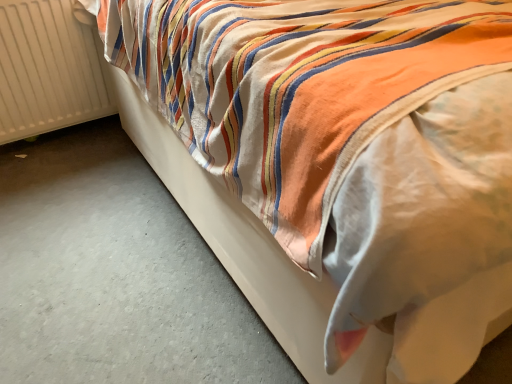
Image resolution: width=512 pixels, height=384 pixels. What do you see at coordinates (47, 70) in the screenshot? I see `white ribbed radiator at left` at bounding box center [47, 70].

Find the location of a particular element. white ribbed radiator at left is located at coordinates (47, 70).

Describe the element at coordinates (114, 274) in the screenshot. The width and height of the screenshot is (512, 384). I see `white smooth concrete at lower left` at that location.

Where is `white smooth concrete at lower left`? The width and height of the screenshot is (512, 384). white smooth concrete at lower left is located at coordinates (114, 274).

This screenshot has width=512, height=384. In order to click on white ribbed radiator at left in this screenshot , I will do `click(47, 70)`.

Does white smooth concrete at lower left appear on the left side of white ribbed radiator at left?

No, white smooth concrete at lower left is not to the left of white ribbed radiator at left.

Which object is closer to the camera, white smooth concrete at lower left or white ribbed radiator at left?

Positioned in front is white smooth concrete at lower left.

Which point is more forward, (7, 175) or (16, 127)?

The point (7, 175) is closer to the camera.

From the picture: From the image's perspective, is white smooth concrete at lower left above or below white ribbed radiator at left?

Clearly, from the image's perspective, white smooth concrete at lower left is below white ribbed radiator at left.

From a real-world perspective, between white smooth concrete at lower left and white ribbed radiator at left, who is vertically higher?

From a 3D spatial view, white ribbed radiator at left is above.

Looking at this image, can you confirm if white smooth concrete at lower left is thinner than white ribbed radiator at left?

No, white smooth concrete at lower left is not thinner than white ribbed radiator at left.

Can you confirm if white smooth concrete at lower left is taller than white ribbed radiator at left?

No.

Can you confirm if white smooth concrete at lower left is smaller than white ribbed radiator at left?

Actually, white smooth concrete at lower left might be larger than white ribbed radiator at left.

Is white smooth concrete at lower left located outside white ribbed radiator at left?

white smooth concrete at lower left lies outside white ribbed radiator at left's area.

Are white smooth concrete at lower left and white ribbed radiator at left making contact?

No.

Is white smooth concrete at lower left oriented towards white ribbed radiator at left?

No.

At what (x,y) coordinates should I click in order to perform the action: click on concrete below the white ribbed radiator at left (from the image's perspective). Please return your answer as a coordinate pair (x, y). This screenshot has width=512, height=384. Looking at the image, I should click on (114, 274).

Can you confirm if white ribbed radiator at left is positioned to the right of white smooth concrete at lower left?

No.

Which object is closer to the camera taking this photo, white ribbed radiator at left or white smooth concrete at lower left?

white smooth concrete at lower left is more forward.

Which is farther, (96, 76) or (170, 310)?

The point (96, 76) is farther from the camera.

From the image's perspective, between white ribbed radiator at left and white smooth concrete at lower left, which one is located above?

white ribbed radiator at left is shown above in the image.

From a real-world perspective, who is located higher, white ribbed radiator at left or white smooth concrete at lower left?

In real-world perspective, white ribbed radiator at left is above.

Between white ribbed radiator at left and white smooth concrete at lower left, which one has larger width?

white smooth concrete at lower left.

Who is shorter, white ribbed radiator at left or white smooth concrete at lower left?

With less height is white smooth concrete at lower left.

Considering the relative sizes of white ribbed radiator at left and white smooth concrete at lower left in the image provided, is white ribbed radiator at left smaller than white smooth concrete at lower left?

Correct, white ribbed radiator at left occupies less space than white smooth concrete at lower left.

Is white ribbed radiator at left not within white smooth concrete at lower left?

Yes, white ribbed radiator at left is located beyond the bounds of white smooth concrete at lower left.

Is white ribbed radiator at left far away from white smooth concrete at lower left?

No, white ribbed radiator at left is in close proximity to white smooth concrete at lower left.

Is white ribbed radiator at left facing away from white smooth concrete at lower left?

No, white ribbed radiator at left is not facing away from white smooth concrete at lower left.

What's the angular difference between white ribbed radiator at left and white smooth concrete at lower left's facing directions?

The facing directions of white ribbed radiator at left and white smooth concrete at lower left are 0.334 degrees apart.

The width and height of the screenshot is (512, 384). I want to click on concrete on the right of the white ribbed radiator at left, so click(114, 274).

I want to click on radiator above the white smooth concrete at lower left (from the image's perspective), so click(47, 70).

Find the location of a particular element. This screenshot has width=512, height=384. radiator behind the white smooth concrete at lower left is located at coordinates pyautogui.click(x=47, y=70).